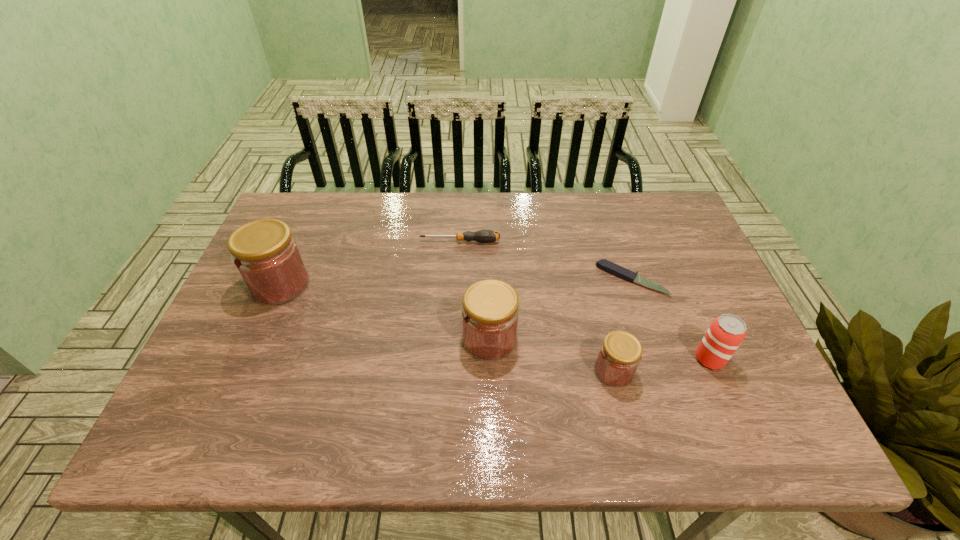
The width and height of the screenshot is (960, 540). In order to click on free spot between the beer can and the fourth tallest object in this screenshot , I will do `click(661, 365)`.

You are a GUI agent. You are given a task and a screenshot of the screen. Output one action in this format:
    pyautogui.click(x=<x>, y=<y>)
    Task: Click on the empty space between the shortest object and the second jam from left to right
    Image resolution: width=960 pixels, height=540 pixels.
    Given the screenshot: What is the action you would take?
    pyautogui.click(x=561, y=309)

This screenshot has width=960, height=540. I want to click on free space that is in between the leftmost object and the screwdriver, so click(x=371, y=262).

Find the location of a particular element. The height and width of the screenshot is (540, 960). free space between the shortest object and the farthest jam is located at coordinates (456, 282).

Find the location of a particular element. the closest object to the fourth tallest object is located at coordinates (725, 334).

Where is `object identified as the fourth closest to the fifth tallest object`? The image size is (960, 540). object identified as the fourth closest to the fifth tallest object is located at coordinates (619, 356).

Point out which jam is positioned as the nearest to the shortest jam. Please provide its 2D coordinates. Your answer should be formatted as a tuple, i.e. [(x, y)], where the tuple contains the x and y coordinates of a point satisfying the conditions above.

[(490, 312)]

This screenshot has width=960, height=540. Identify the location of the second closest jam relative to the leftmost object. (619, 356).

This screenshot has height=540, width=960. I want to click on free space that satisfies the following two spatial constraints: 1. on the front side of the beer can; 2. on the right side of the leftmost jam, so click(x=249, y=359).